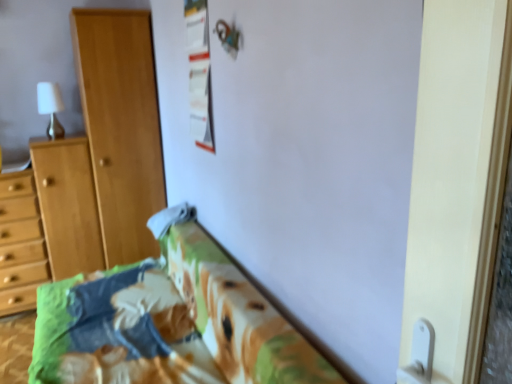
Question: Considering the relative sizes of printed fabric bedspread at lower center and white glossy screen door at right in the image provided, is printed fabric bedspread at lower center smaller than white glossy screen door at right?

Choices:
 (A) no
 (B) yes

Answer: (A)

Question: From the image's perspective, is printed fabric bedspread at lower center located above white glossy screen door at right?

Choices:
 (A) yes
 (B) no

Answer: (B)

Question: Is printed fabric bedspread at lower center further to the viewer compared to white glossy screen door at right?

Choices:
 (A) no
 (B) yes

Answer: (B)

Question: Is printed fabric bedspread at lower center at the right side of white glossy screen door at right?

Choices:
 (A) no
 (B) yes

Answer: (A)

Question: From a real-world perspective, is printed fabric bedspread at lower center beneath white glossy screen door at right?

Choices:
 (A) yes
 (B) no

Answer: (A)

Question: Is the position of printed fabric bedspread at lower center less distant than that of white glossy screen door at right?

Choices:
 (A) yes
 (B) no

Answer: (B)

Question: From the image's perspective, is white glossy screen door at right located beneath white matte lamp at upper left?

Choices:
 (A) no
 (B) yes

Answer: (B)

Question: Is white glossy screen door at right smaller than white matte lamp at upper left?

Choices:
 (A) yes
 (B) no

Answer: (B)

Question: Is white matte lamp at upper left located within white glossy screen door at right?

Choices:
 (A) yes
 (B) no

Answer: (B)

Question: Is the depth of white glossy screen door at right less than that of white matte lamp at upper left?

Choices:
 (A) yes
 (B) no

Answer: (A)

Question: From the image's perspective, would you say white glossy screen door at right is positioned over white matte lamp at upper left?

Choices:
 (A) no
 (B) yes

Answer: (A)

Question: Can you confirm if white glossy screen door at right is positioned to the left of white matte lamp at upper left?

Choices:
 (A) yes
 (B) no

Answer: (B)

Question: Can you confirm if white matte lamp at upper left is wider than light brown wooden cupboard at left?

Choices:
 (A) no
 (B) yes

Answer: (A)